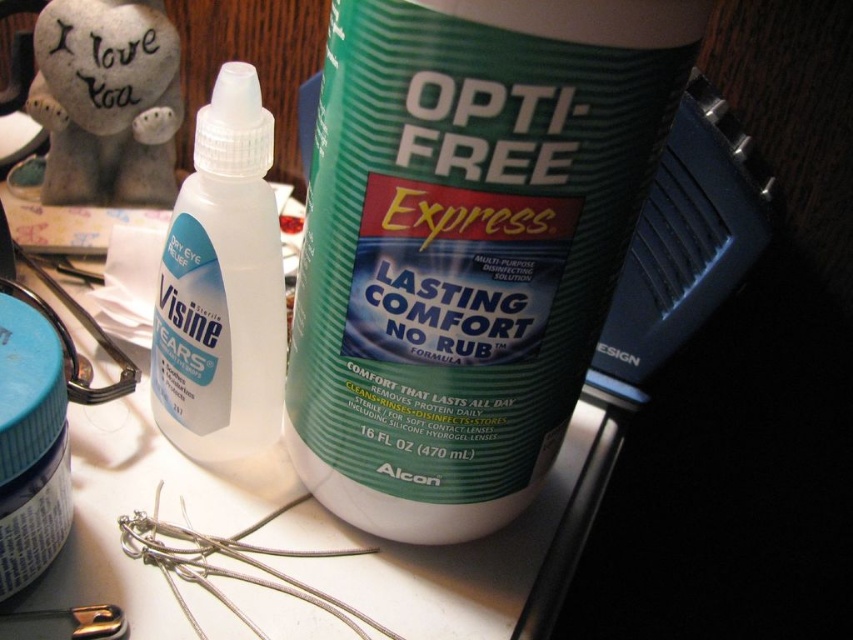
You are organizing a first aid kit and need to know which item is taller between the green plastic bottle at center and the matte blue jar at lower left. Which one is taller?

The green plastic bottle at center is taller than the matte blue jar at lower left.

You are organizing a first aid kit and need to place the green plastic bottle at center and the matte blue jar at lower left into a compartment. The compartment can only fit items that are narrower than 10 cm. Which item should you place first to ensure both fit?

The matte blue jar at lower left should be placed first because the green plastic bottle at center is wider than the matte blue jar at lower left, so placing the narrower jar first allows the wider bottle to fit afterward.

You have a green plastic bottle at center and another object. The distance between them is 14.19 inches. If you need to place a ruler between them to measure the distance, which direction should you place the ruler to ensure it reaches both objects?

The ruler should be placed horizontally between the green plastic bottle at center and the other object to measure the 14.19 inches distance accurately.